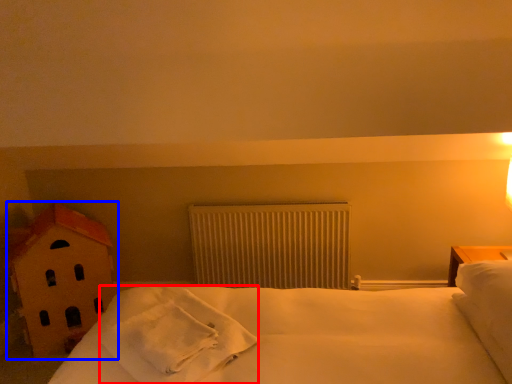
Question: Which of the following is the closest to the observer, material (highlighted by a red box) or toy (highlighted by a blue box)?

Choices:
 (A) material
 (B) toy

Answer: (A)